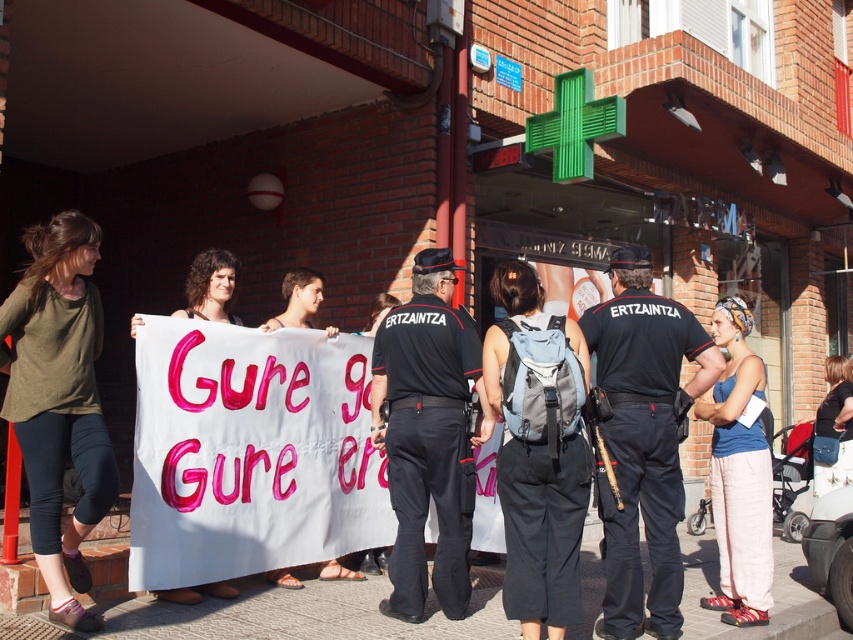
Which is above, black uniform at center or gray fabric backpack at center?

Positioned higher is gray fabric backpack at center.

Describe the element at coordinates (643, 440) in the screenshot. I see `black uniform at center` at that location.

Locate an element on the screen. black uniform at center is located at coordinates (643, 440).

Identify the location of black uniform at center. (643, 440).

Does black uniform at center appear on the right side of blue cotton tank top at center?

Incorrect, black uniform at center is not on the right side of blue cotton tank top at center.

Is black uniform at center thinner than blue cotton tank top at center?

No, black uniform at center is not thinner than blue cotton tank top at center.

Image resolution: width=853 pixels, height=640 pixels. Describe the element at coordinates (643, 440) in the screenshot. I see `black uniform at center` at that location.

Where is `black uniform at center`? The width and height of the screenshot is (853, 640). black uniform at center is located at coordinates [643, 440].

Does gray concrete pavement at lower center have a lesser width compared to gray fabric backpack at center?

No, gray concrete pavement at lower center is not thinner than gray fabric backpack at center.

This screenshot has height=640, width=853. Describe the element at coordinates (285, 616) in the screenshot. I see `gray concrete pavement at lower center` at that location.

Find the location of a particular element. gray concrete pavement at lower center is located at coordinates (285, 616).